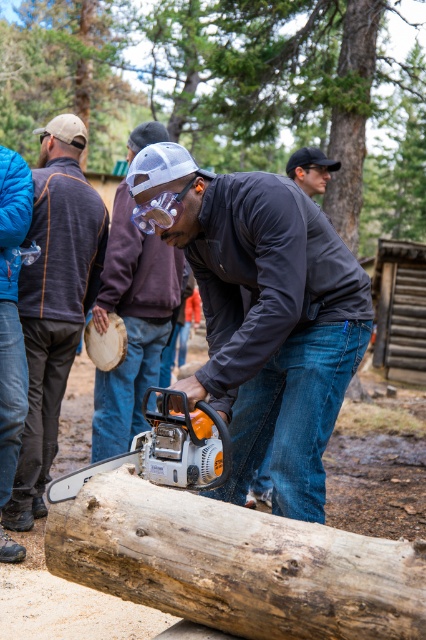
Between matte black chainsaw at center and dark gray jacket at center, which one has less height?

With less height is dark gray jacket at center.

Identify the location of matte black chainsaw at center. This screenshot has height=640, width=426. (261, 314).

Identify the location of matte black chainsaw at center. This screenshot has height=640, width=426. (261, 314).

Between matte black chainsaw at left and dark gray jacket at center, which one is positioned lower?

Positioned lower is matte black chainsaw at left.

Is point (58, 253) in front of point (290, 177)?

Yes, it is.

Who is more forward, [69,198] or [304,160]?

Positioned in front is point [69,198].

You are a GUI agent. You are given a task and a screenshot of the screen. Output one action in this format:
    pyautogui.click(x=<x>, y=<y>)
    Task: Click on the matte black chainsaw at left
    
    Given the screenshot: What is the action you would take?
    pyautogui.click(x=54, y=301)

Can you confirm if matte white helmet at center is positioned to the right of dark gray jacket at center?

In fact, matte white helmet at center is to the left of dark gray jacket at center.

Between matte white helmet at center and dark gray jacket at center, which one has more height?

With more height is matte white helmet at center.

Does point (169, 314) come behind point (310, 148)?

That is False.

You are a GUI agent. You are given a task and a screenshot of the screen. Output one action in this format:
    pyautogui.click(x=<x>, y=<y>)
    Task: Click on the matte white helmet at center
    
    Given the screenshot: What is the action you would take?
    pyautogui.click(x=132, y=323)